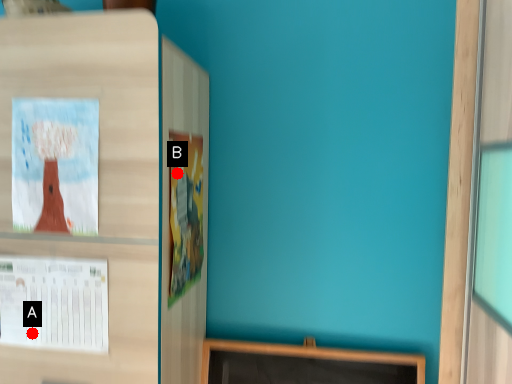
Question: Two points are circled on the image, labeled by A and B beside each circle. Which of the following is the farthest from the observer?

Choices:
 (A) A is further
 (B) B is further

Answer: (B)